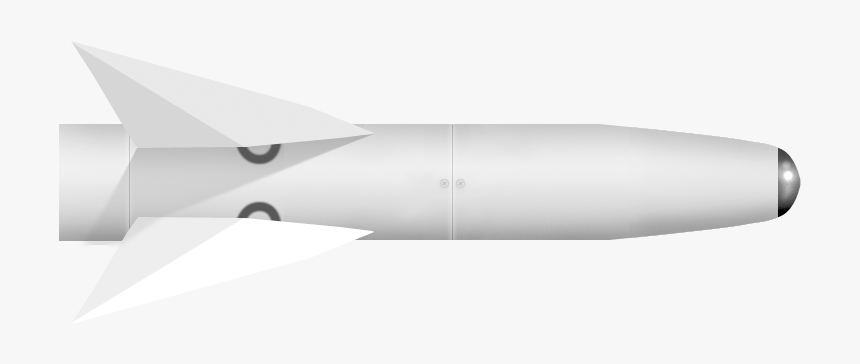
Find the location of `screws`. screws is located at coordinates (477, 184), (445, 177).